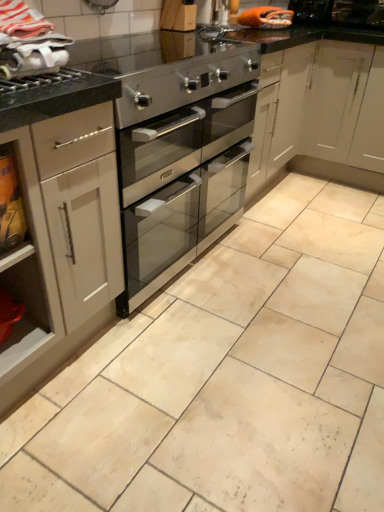
Question: Is white matte cabinet at left thinner than white fabric at upper left?

Choices:
 (A) no
 (B) yes

Answer: (A)

Question: Is white matte cabinet at left directly adjacent to white fabric at upper left?

Choices:
 (A) no
 (B) yes

Answer: (A)

Question: From a real-world perspective, is white matte cabinet at left physically below white fabric at upper left?

Choices:
 (A) no
 (B) yes

Answer: (B)

Question: Is white matte cabinet at left wider than white fabric at upper left?

Choices:
 (A) no
 (B) yes

Answer: (B)

Question: Can you confirm if white matte cabinet at left is smaller than white fabric at upper left?

Choices:
 (A) yes
 (B) no

Answer: (B)

Question: Is white matte cabinet at left shorter than white fabric at upper left?

Choices:
 (A) yes
 (B) no

Answer: (B)

Question: Is satin silver oven at center placed right next to white matte cabinet at left?

Choices:
 (A) no
 (B) yes

Answer: (A)

Question: Is satin silver oven at center shorter than white matte cabinet at left?

Choices:
 (A) no
 (B) yes

Answer: (B)

Question: Is satin silver oven at center positioned in front of white matte cabinet at left?

Choices:
 (A) yes
 (B) no

Answer: (B)

Question: Considering the relative positions of satin silver oven at center and white matte cabinet at left in the image provided, is satin silver oven at center to the left of white matte cabinet at left from the viewer's perspective?

Choices:
 (A) no
 (B) yes

Answer: (A)

Question: From a real-world perspective, is satin silver oven at center located higher than white matte cabinet at left?

Choices:
 (A) yes
 (B) no

Answer: (B)

Question: Can you confirm if satin silver oven at center is positioned to the right of white matte cabinet at left?

Choices:
 (A) no
 (B) yes

Answer: (B)

Question: Is white fabric at upper left further to camera compared to brushed metal gas stove at upper left?

Choices:
 (A) yes
 (B) no

Answer: (B)